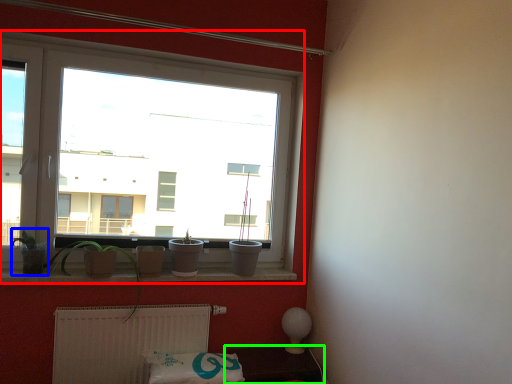
Question: Based on their relative distances, which object is nearer to window (highlighted by a red box)? Choose from plant (highlighted by a blue box) and furniture (highlighted by a green box).

Choices:
 (A) plant
 (B) furniture

Answer: (A)